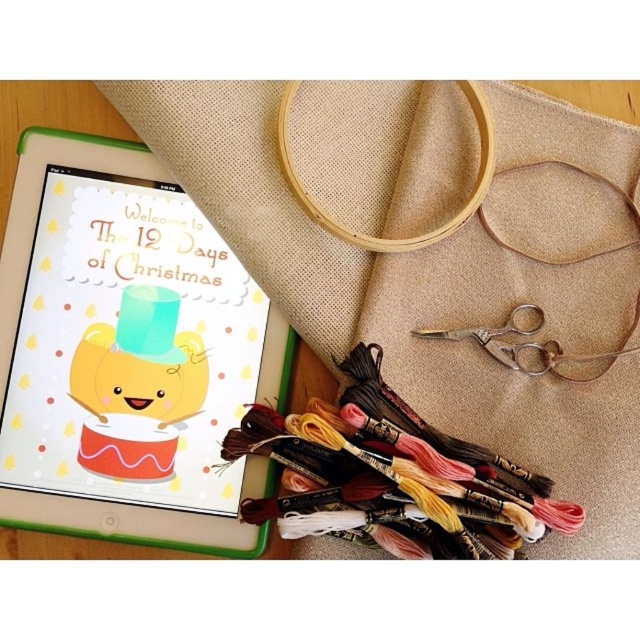
Question: Is the position of beige fabric at upper center less distant than that of antique brass scissors at center?

Choices:
 (A) no
 (B) yes

Answer: (B)

Question: Which point is farther to the camera?

Choices:
 (A) antique brass scissors at center
 (B) beige fabric at upper center

Answer: (A)

Question: Does beige fabric at upper center come behind antique brass scissors at center?

Choices:
 (A) no
 (B) yes

Answer: (A)

Question: Is beige fabric at upper center positioned at the back of antique brass scissors at center?

Choices:
 (A) no
 (B) yes

Answer: (A)

Question: Which point is closer to the camera?

Choices:
 (A) (500, 179)
 (B) (461, 328)

Answer: (B)